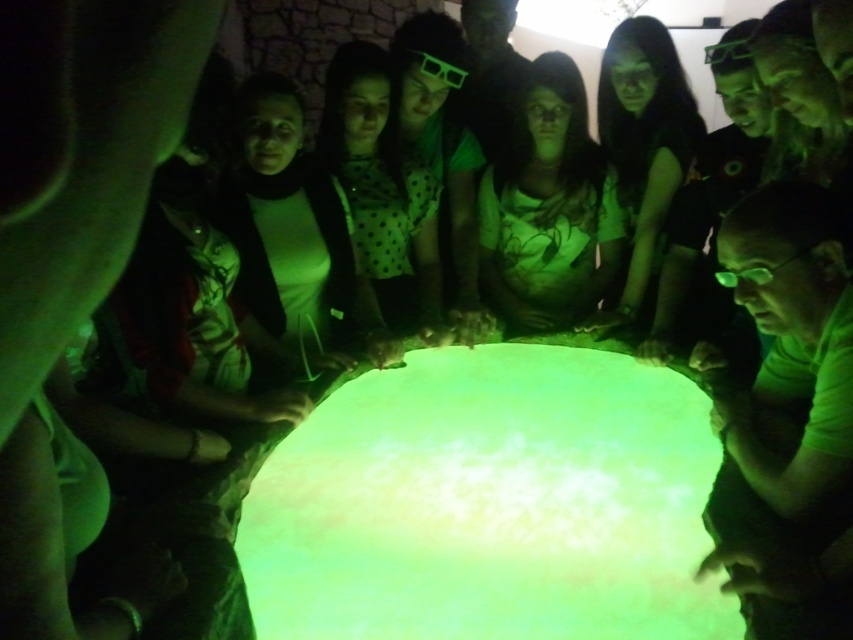
You are a photographer in a dimly lit room and need to capture a clear image of the green glowing surface at center and the white matte shirt at center. Since the room is dark, you want to ensure that both objects are well lit. Which object should you adjust your camera focus on first to account for their sizes?

The green glowing surface at center has a lesser height compared to the white matte shirt at center, so you should focus on the white matte shirt at center first because it is taller and might require more precise lighting adjustments.

You are planning to take a photo of the green glowing surface at center and the white matte shirt at center. Which object should you focus on first if you want to capture both in a single frame without moving the camera?

You should focus on the green glowing surface at center first because it is larger than the white matte shirt at center, making it the more dominant subject in the frame.